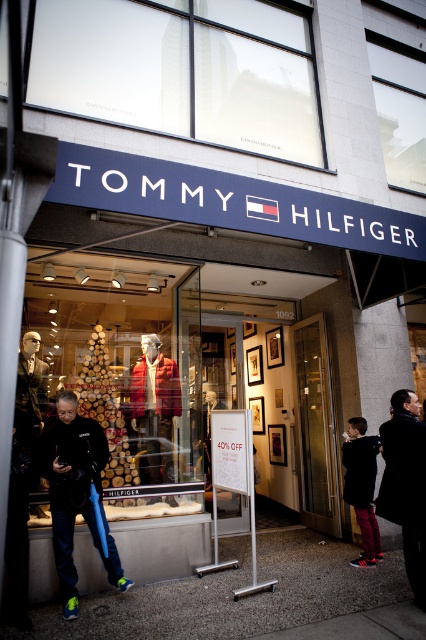
Between point (250, 51) and point (408, 442), which one is positioned in front?

Point (408, 442) is in front.

Is transparent glass at upper center positioned before dark gray coat at lower right?

No, transparent glass at upper center is further to the viewer.

Is point (204, 1) positioned behind point (397, 448)?

Yes, point (204, 1) is farther from viewer.

What are the coordinates of `transparent glass at upper center` in the screenshot? It's located at (183, 70).

Consider the image. Measure the distance between point (180, 45) and camera.

19.13 feet

This screenshot has height=640, width=426. Find the location of `transparent glass at upper center`. transparent glass at upper center is located at coordinates (183, 70).

Which of these two, black matte jacket at lower left or dark gray coat at lower right, stands taller?

With more height is black matte jacket at lower left.

Between black matte jacket at lower left and dark gray coat at lower right, which one appears on the left side from the viewer's perspective?

From the viewer's perspective, black matte jacket at lower left appears more on the left side.

Is point (71, 480) positioned after point (403, 456)?

Yes.

What are the coordinates of `black matte jacket at lower left` in the screenshot? It's located at (77, 493).